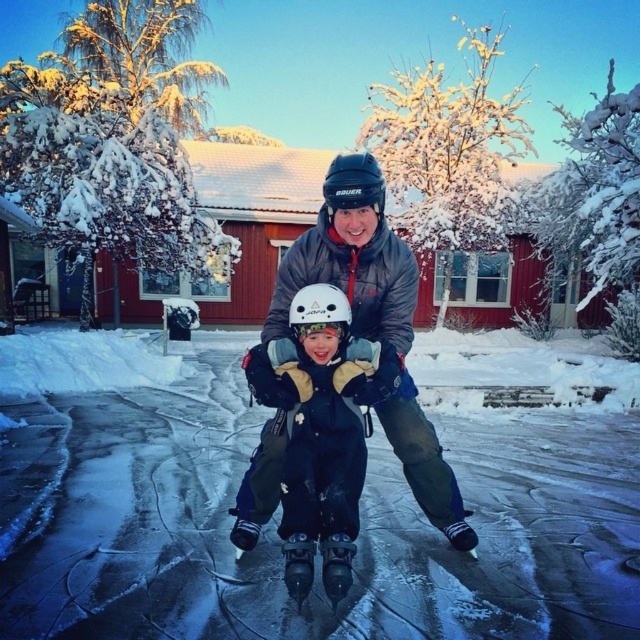
Image resolution: width=640 pixels, height=640 pixels. Describe the element at coordinates (352, 276) in the screenshot. I see `matte gray jacket at center` at that location.

This screenshot has width=640, height=640. What are the coordinates of `matte gray jacket at center` in the screenshot? It's located at (352, 276).

Is black matte helmet at center wider than white matte helmet at center?

Yes, black matte helmet at center is wider than white matte helmet at center.

Between black matte helmet at center and white matte helmet at center, which one appears on the right side from the viewer's perspective?

black matte helmet at center

Who is more forward, [372,179] or [304,312]?

Point [304,312] is more forward.

Where is `black matte helmet at center`? black matte helmet at center is located at coordinates (353, 184).

Which is more to the left, white fluffy snow at center or black matte helmet at center?

black matte helmet at center

Between white fluffy snow at center and black matte helmet at center, which one has less height?

black matte helmet at center

Locate an element on the screen. Image resolution: width=640 pixels, height=640 pixels. white fluffy snow at center is located at coordinates (278, 509).

Locate an element on the screen. white fluffy snow at center is located at coordinates (278, 509).